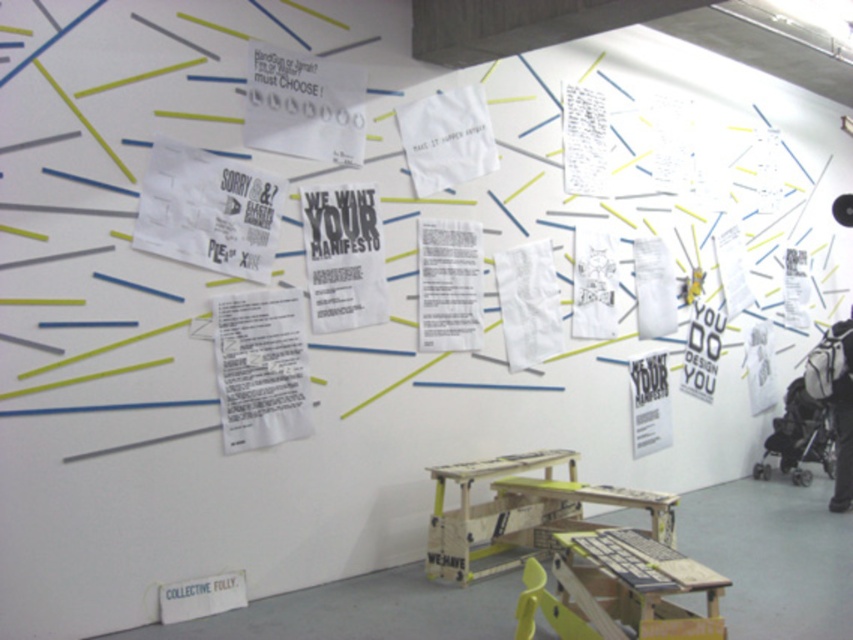
In the scene shown: You are an artist standing in front of the white wall with the two white papers. You want to hang a new paper between them. Is the white paper at upper center closer to you than the white paper at center?

Yes, the white paper at upper center is in front of the white paper at center, so it is closer to you.

You are an artist planning to hang a new manifesto on the wall. You have two white papers available. One is the white paper at upper center and the other is the white paper at center. Which one can accommodate more text without needing to be resized?

The white paper at upper center can accommodate more text without needing to be resized because it is bigger than the white paper at center.

You are standing in the art exhibition and see two points marked on the wall. The first point is at coordinates point [426,99] and the second at point [550,305]. Which point is closer to you?

Point [426,99] is in front of point [550,305], so it is closer to you.